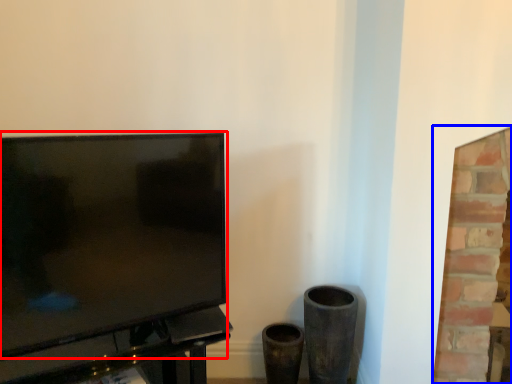
Question: Among these objects, which one is nearest to the camera, television (highlighted by a red box) or fireplace (highlighted by a blue box)?

Choices:
 (A) television
 (B) fireplace

Answer: (A)